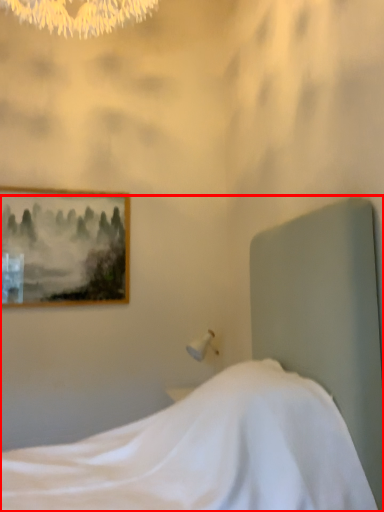
Question: From the image's perspective, what is the correct spatial positioning of bed (annotated by the red box) in reference to picture frame?

Choices:
 (A) below
 (B) above

Answer: (A)